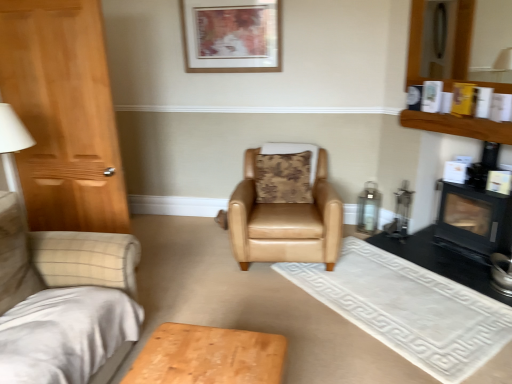
Question: Is black matte fireplace at right wider or thinner than camouflage fabric pillow at center?

Choices:
 (A) wide
 (B) thin

Answer: (B)

Question: In terms of size, does black matte fireplace at right appear bigger or smaller than camouflage fabric pillow at center?

Choices:
 (A) big
 (B) small

Answer: (A)

Question: Estimate the real-world distances between objects in this image. Which object is closer to the tan leather armchair at center?

Choices:
 (A) wooden shelf at upper right
 (B) wooden picture frame at upper center
 (C) black matte fireplace at right
 (D) camouflage fabric pillow at center

Answer: (D)

Question: Considering the real-world distances, which object is farthest from the black matte fireplace at right?

Choices:
 (A) tan leather armchair at center
 (B) camouflage fabric pillow at center
 (C) wooden picture frame at upper center
 (D) wooden shelf at upper right

Answer: (C)